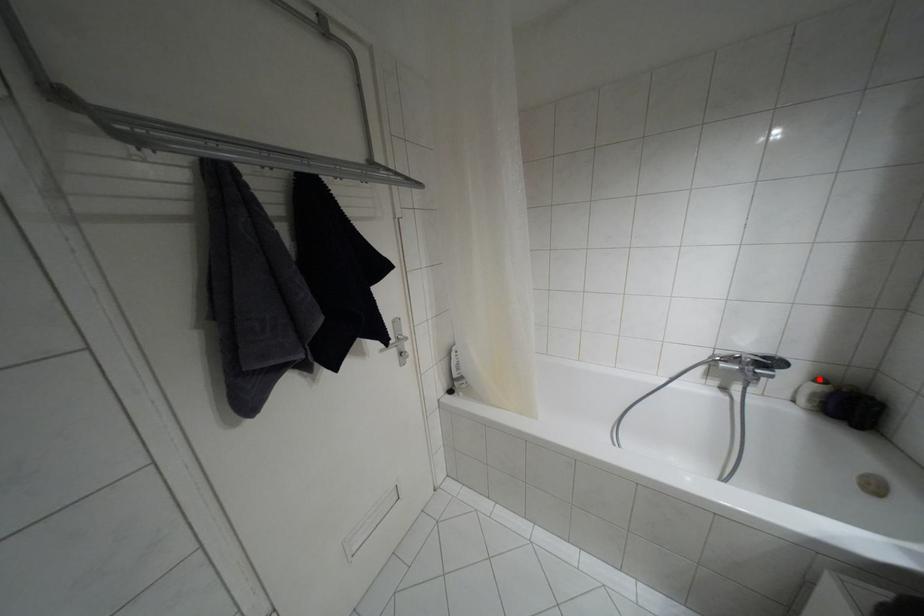
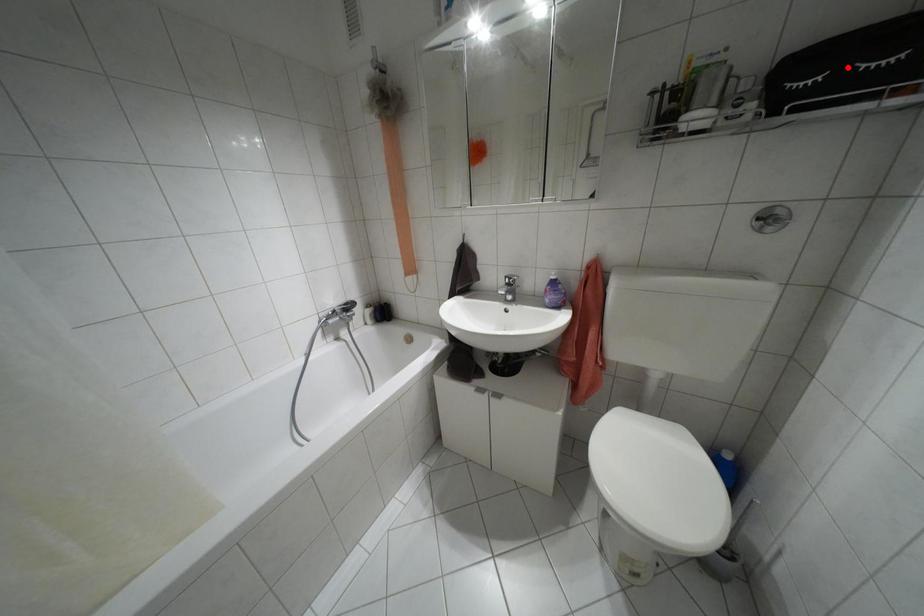
I am providing you with two images of the same scene from different viewpoints. A red point is marked on the first image and another point is marked on the second image. Does the point marked in image1 correspond to the same location as the one in image2?

No